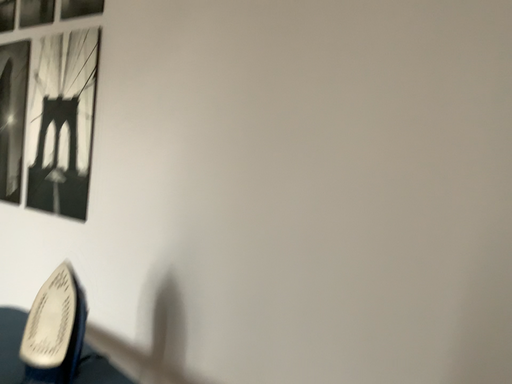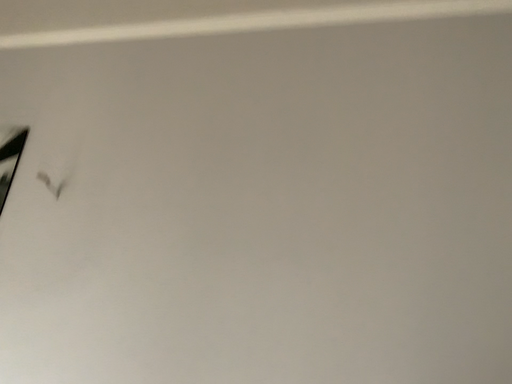
Question: Which way did the camera rotate in the video?

Choices:
 (A) rotated right
 (B) rotated left

Answer: (A)